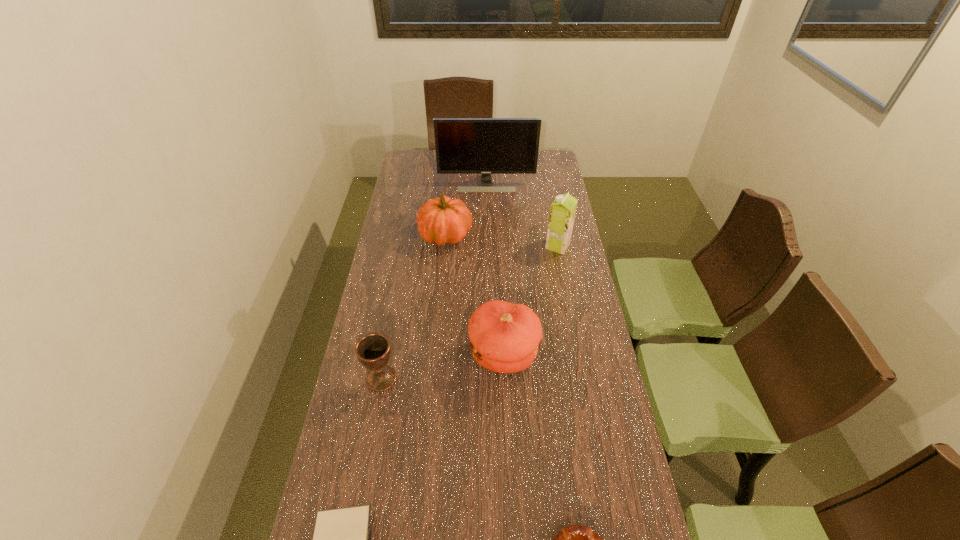
Where is `free space that is in between the nearer pumpkin and the monitor`? This screenshot has height=540, width=960. free space that is in between the nearer pumpkin and the monitor is located at coordinates (495, 269).

Identify the location of vacant point located between the farther pumpkin and the chalice. This screenshot has height=540, width=960. coord(414,307).

Point out which object is positioned as the nearest to the Bible. Please provide its 2D coordinates. Your answer should be formatted as a tuple, i.e. [(x, y)], where the tuple contains the x and y coordinates of a point satisfying the conditions above.

[(373, 350)]

Image resolution: width=960 pixels, height=540 pixels. Find the location of `object identified as the closest to the chalice`. object identified as the closest to the chalice is located at coordinates (504, 337).